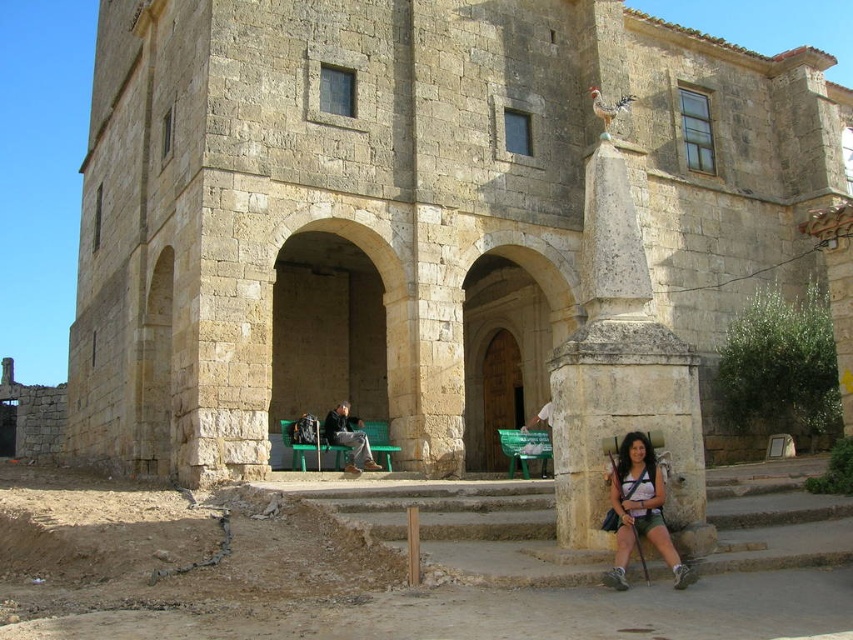
In the scene shown: Which of these two, stone column at center or matte white shirt at lower right, stands shorter?

matte white shirt at lower right is shorter.

What do you see at coordinates (621, 372) in the screenshot? This screenshot has height=640, width=853. I see `stone column at center` at bounding box center [621, 372].

This screenshot has width=853, height=640. I want to click on stone column at center, so click(621, 372).

Looking at this image, between matte white shirt at lower right and dark brown leather jacket at center, which one has less height?

With less height is dark brown leather jacket at center.

Between matte white shirt at lower right and dark brown leather jacket at center, which one appears on the left side from the viewer's perspective?

Positioned to the left is dark brown leather jacket at center.

You are a GUI agent. You are given a task and a screenshot of the screen. Output one action in this format:
    pyautogui.click(x=<x>, y=<y>)
    Task: Click on the matte white shirt at lower right
    
    Given the screenshot: What is the action you would take?
    pyautogui.click(x=637, y=509)

Identify the location of matte white shirt at lower right. tap(637, 509).

Between stone column at center and dark brown leather jacket at center, which one has less height?

Standing shorter between the two is dark brown leather jacket at center.

Which is more to the left, stone column at center or dark brown leather jacket at center?

dark brown leather jacket at center

Where is `stone column at center`? The width and height of the screenshot is (853, 640). stone column at center is located at coordinates (621, 372).